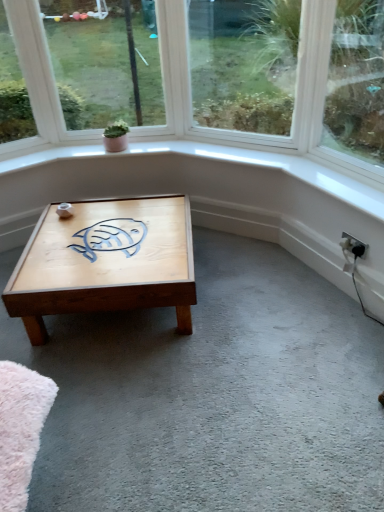
Question: From the image's perspective, is clear glass window at center, the first window from the right, under green matte plant at upper center?

Choices:
 (A) yes
 (B) no

Answer: (B)

Question: Can you confirm if clear glass window at center, the first window from the right, is taller than green matte plant at upper center?

Choices:
 (A) yes
 (B) no

Answer: (A)

Question: Does clear glass window at center, positioned as the second window in left-to-right order, have a larger size compared to green matte plant at upper center?

Choices:
 (A) yes
 (B) no

Answer: (A)

Question: Is clear glass window at center, the first window from the right, not near green matte plant at upper center?

Choices:
 (A) yes
 (B) no

Answer: (A)

Question: From the image's perspective, is clear glass window at center, the first window from the right, on top of green matte plant at upper center?

Choices:
 (A) no
 (B) yes

Answer: (B)

Question: Does clear glass window at center, positioned as the second window in left-to-right order, have a greater width compared to green matte plant at upper center?

Choices:
 (A) no
 (B) yes

Answer: (A)

Question: Does light brown wooden coffee table at center have a smaller size compared to clear glass window at center, the first window from the right?

Choices:
 (A) no
 (B) yes

Answer: (A)

Question: From the image's perspective, is light brown wooden coffee table at center beneath clear glass window at center, the first window from the right?

Choices:
 (A) no
 (B) yes

Answer: (B)

Question: Could you tell me if light brown wooden coffee table at center is facing clear glass window at center, the first window from the right?

Choices:
 (A) yes
 (B) no

Answer: (B)

Question: Can you confirm if light brown wooden coffee table at center is shorter than clear glass window at center, the first window from the right?

Choices:
 (A) no
 (B) yes

Answer: (B)

Question: Does light brown wooden coffee table at center come behind clear glass window at center, positioned as the second window in left-to-right order?

Choices:
 (A) yes
 (B) no

Answer: (B)

Question: Considering the relative positions of light brown wooden coffee table at center and clear glass window at center, the first window from the right, in the image provided, is light brown wooden coffee table at center to the right of clear glass window at center, the first window from the right, from the viewer's perspective?

Choices:
 (A) yes
 (B) no

Answer: (B)

Question: From a real-world perspective, is light brown wooden coffee table at center physically below white plastic electric outlet at lower right?

Choices:
 (A) yes
 (B) no

Answer: (A)